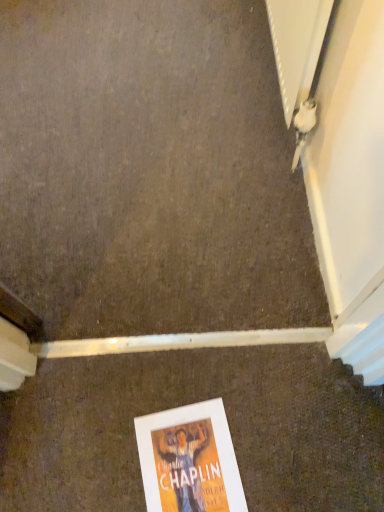
You are a GUI agent. You are given a task and a screenshot of the screen. Output one action in this format:
    pyautogui.click(x=<x>, y=<y>)
    Task: Click on the orange paper poster at lower center
    
    Given the screenshot: What is the action you would take?
    pyautogui.click(x=189, y=460)

What do you see at coordinates (189, 460) in the screenshot?
I see `orange paper poster at lower center` at bounding box center [189, 460].

Locate an element on the screen. The image size is (384, 512). orange paper poster at lower center is located at coordinates (189, 460).